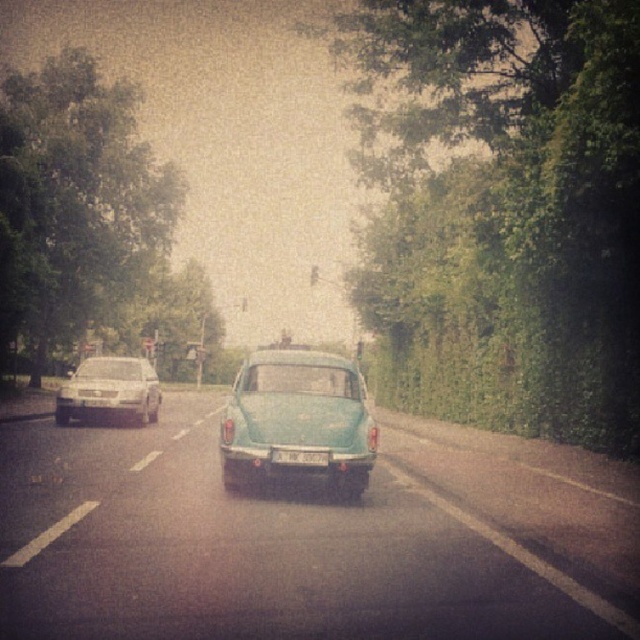
Who is taller, silver metallic sedan at left or white plastic license plate at center?

silver metallic sedan at left is taller.

Which is above, silver metallic sedan at left or white plastic license plate at center?

silver metallic sedan at left is higher up.

Is point (99, 392) closer to viewer compared to point (316, 452)?

No, it is behind (316, 452).

You are a GUI agent. You are given a task and a screenshot of the screen. Output one action in this format:
    pyautogui.click(x=<x>, y=<y>)
    Task: Click on the silver metallic sedan at left
    The image size is (640, 640).
    Given the screenshot: What is the action you would take?
    pyautogui.click(x=109, y=390)

Is green leafy wall at center positioned behind white plastic license plate at center?

Yes, it is.

Does point (596, 314) lie in front of point (308, 449)?

No, (596, 314) is behind (308, 449).

I want to click on green leafy wall at center, so click(499, 209).

Locate an element on the screen. green leafy wall at center is located at coordinates (499, 209).

Based on the photo, who is taller, green leafy wall at center or teal glossy car at center?

Standing taller between the two is green leafy wall at center.

Is green leafy wall at center taller than teal glossy car at center?

Yes.

Is point (362, 106) less distant than point (221, 472)?

No, (362, 106) is further to viewer.

Where is `green leafy wall at center`? The width and height of the screenshot is (640, 640). green leafy wall at center is located at coordinates (499, 209).